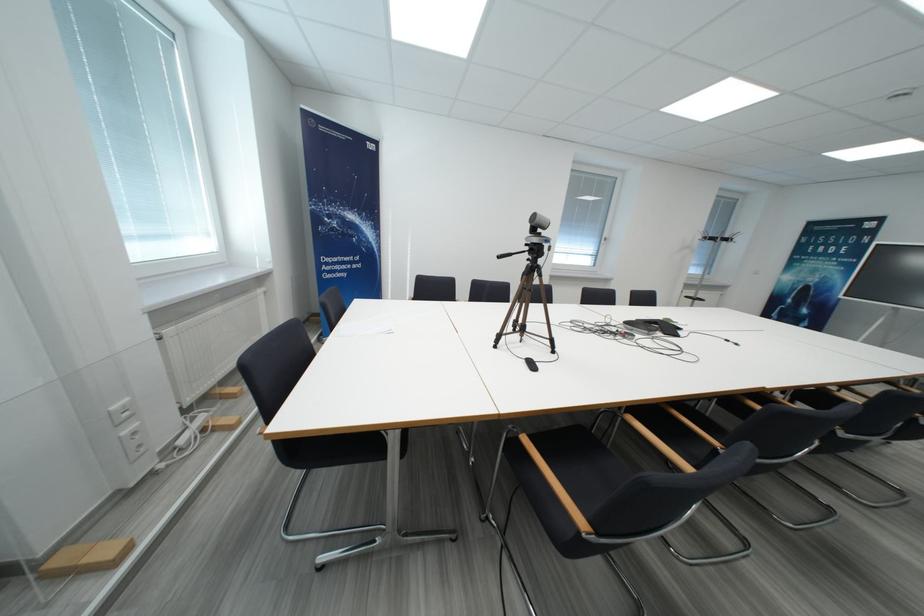
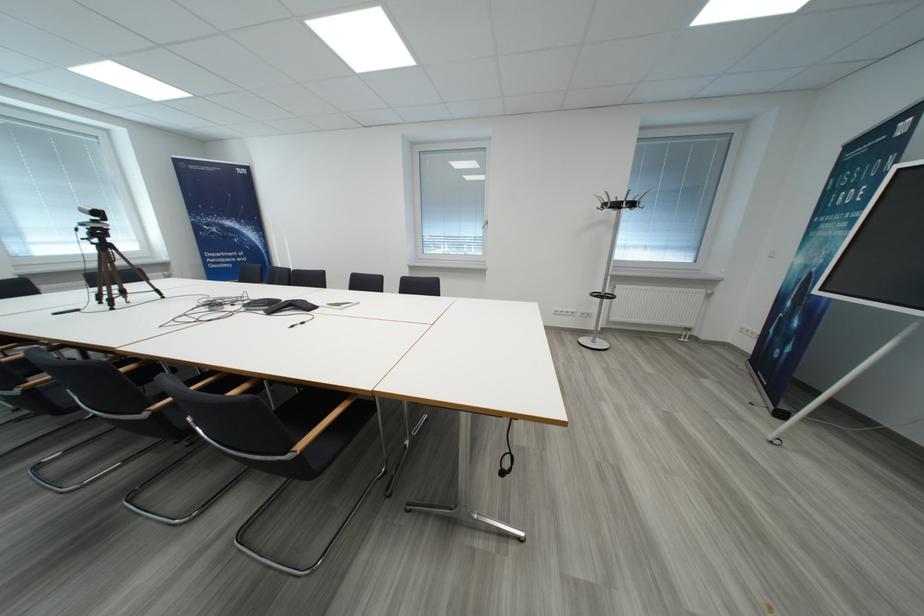
The point at (531, 254) is marked in the first image. Where is the corresponding point in the second image?

(110, 237)